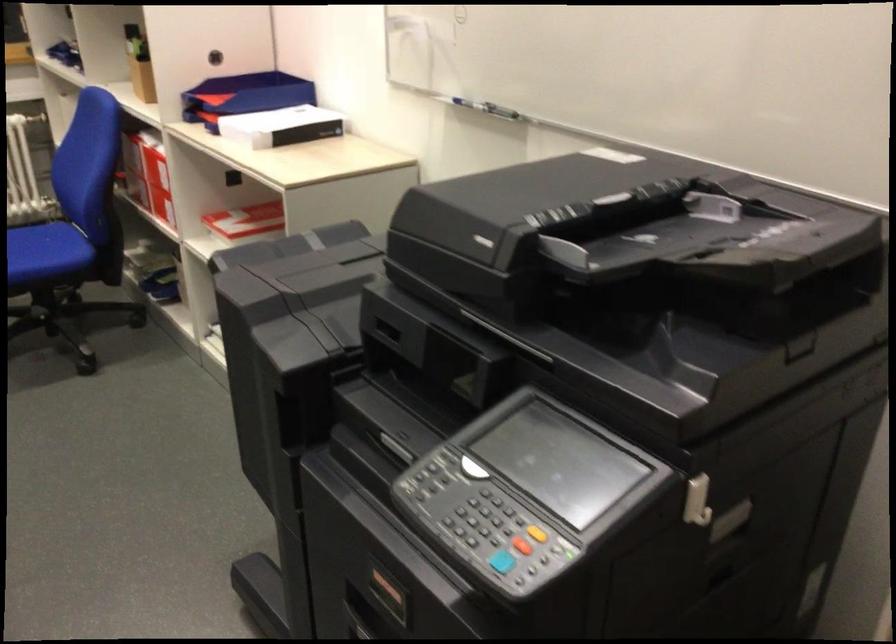
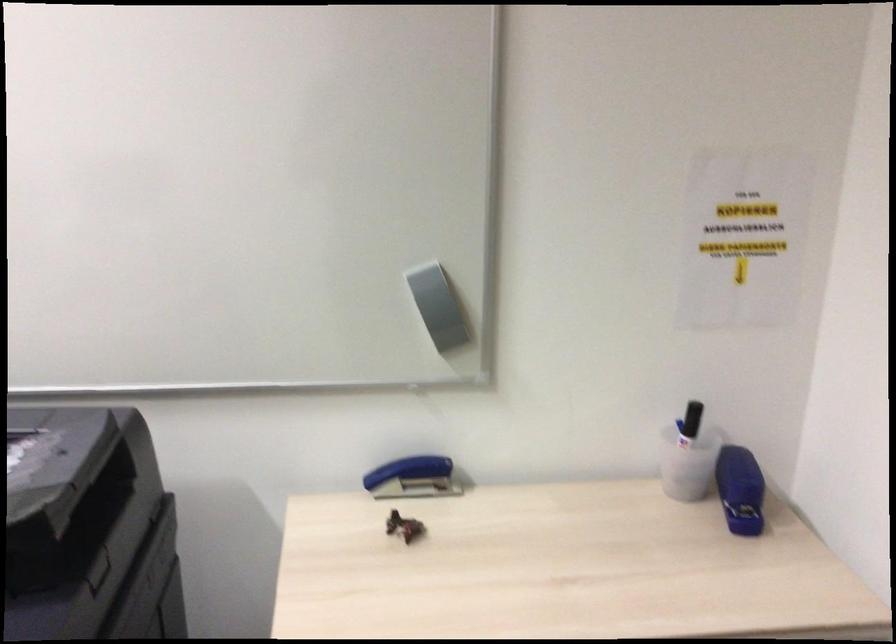
Question: The camera is either moving clockwise (left) or counter-clockwise (right) around the object. The first image is from the beginning of the video and the second image is from the end. Is the camera moving left or right when shooting the video?

Choices:
 (A) Left
 (B) Right

Answer: (A)